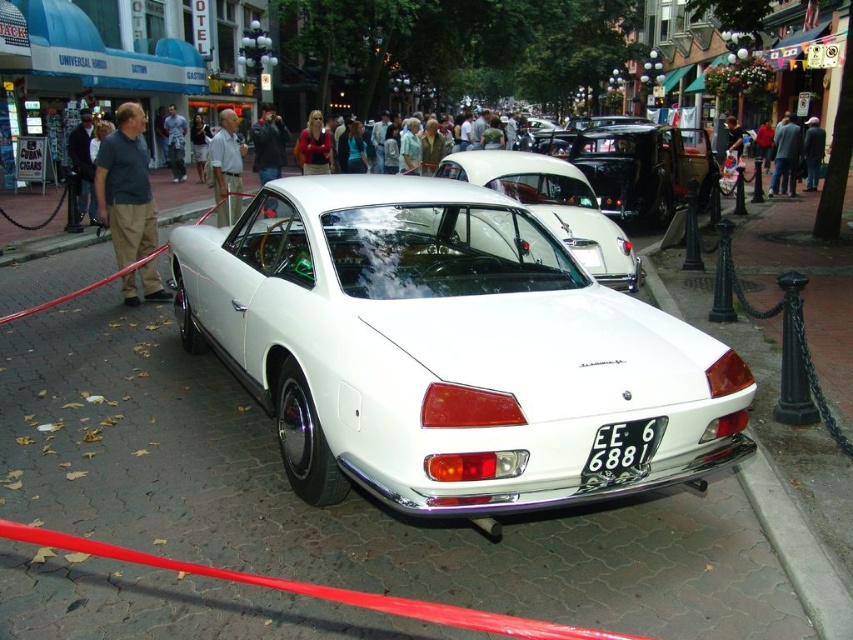
Looking at this image, which of these two, dark blue shirt at center or black metal license plate at center, stands taller?

With more height is dark blue shirt at center.

Is dark blue shirt at center further to the viewer compared to black metal license plate at center?

That is True.

Find the location of a particular element. dark blue shirt at center is located at coordinates pos(126,188).

Is point (135, 202) more distant than point (779, 179)?

No, it is in front of (779, 179).

Is dark blue shirt at center to the right of dark gray jacket at center from the viewer's perspective?

No, dark blue shirt at center is not to the right of dark gray jacket at center.

I want to click on dark blue shirt at center, so click(x=126, y=188).

Image resolution: width=853 pixels, height=640 pixels. Identify the location of dark blue shirt at center. (126, 188).

Does gray shirt at center appear under denim jacket at center?

Correct, gray shirt at center is located below denim jacket at center.

The height and width of the screenshot is (640, 853). In order to click on gray shirt at center in this screenshot , I will do `click(225, 168)`.

Find the location of `gray shirt at center`. gray shirt at center is located at coordinates (225, 168).